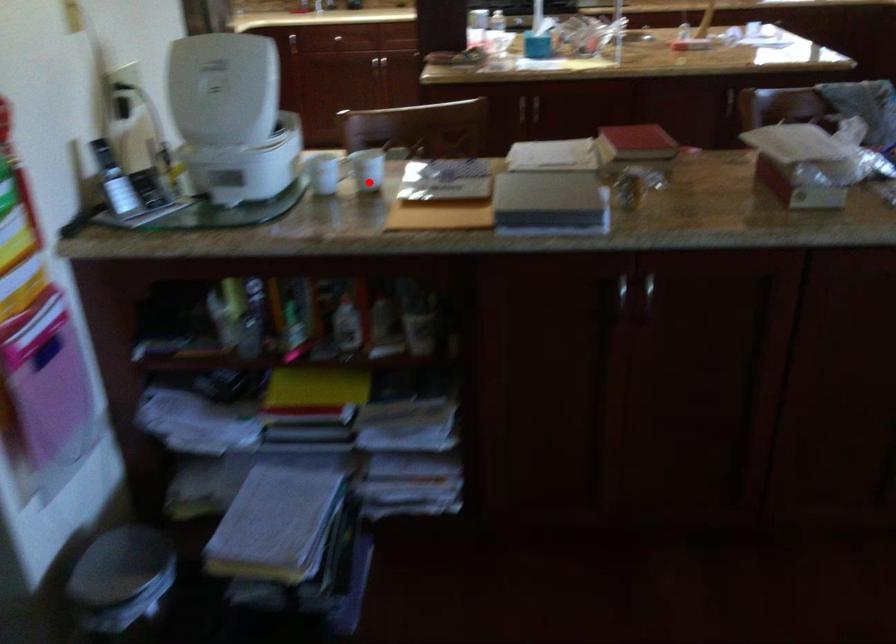
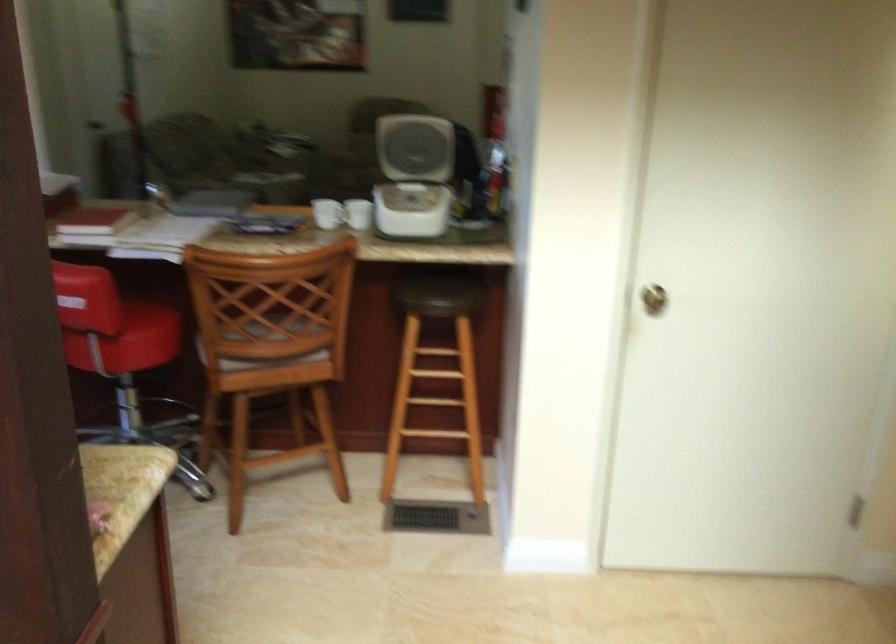
Find the pixel in the second image that matches the highlighted location in the first image.

(326, 214)